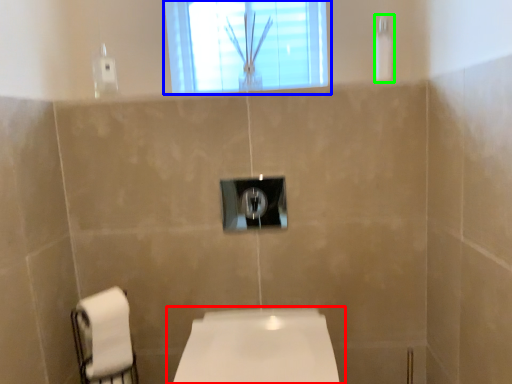
Question: Which object is the farthest from toilet (highlighted by a red box)? Choose among these: window (highlighted by a blue box) or shower (highlighted by a green box).

Choices:
 (A) window
 (B) shower

Answer: (A)